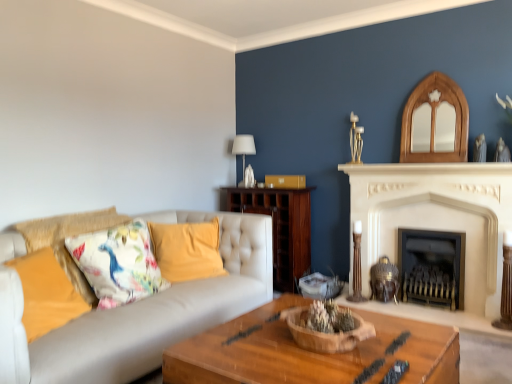
Question: From a real-world perspective, is wooden bowl at center physically located above or below white fabric lampshade at upper center?

Choices:
 (A) above
 (B) below

Answer: (B)

Question: Considering the positions of point (303, 319) and point (233, 139), is point (303, 319) closer or farther from the camera than point (233, 139)?

Choices:
 (A) closer
 (B) farther

Answer: (A)

Question: Which object is the farthest from the yellow fabric pillow at center, acting as the second pillow starting from the front?

Choices:
 (A) dark brown wood cabinet at center
 (B) floral fabric cushion at left, acting as the first pillow starting from the front
 (C) white stone fireplace at center, the first fireplace positioned from the left
 (D) white fabric lampshade at upper center
 (E) wooden bowl at center

Answer: (C)

Question: Considering the real-world distances, which object is farthest from the white fabric lampshade at upper center?

Choices:
 (A) white marble fireplace at upper center
 (B) black metal fireplace at center, arranged as the 1th fireplace when viewed from the right
 (C) white stone fireplace at center, the 2th fireplace positioned from the right
 (D) wooden coffee table at center
 (E) dark brown wood cabinet at center

Answer: (D)